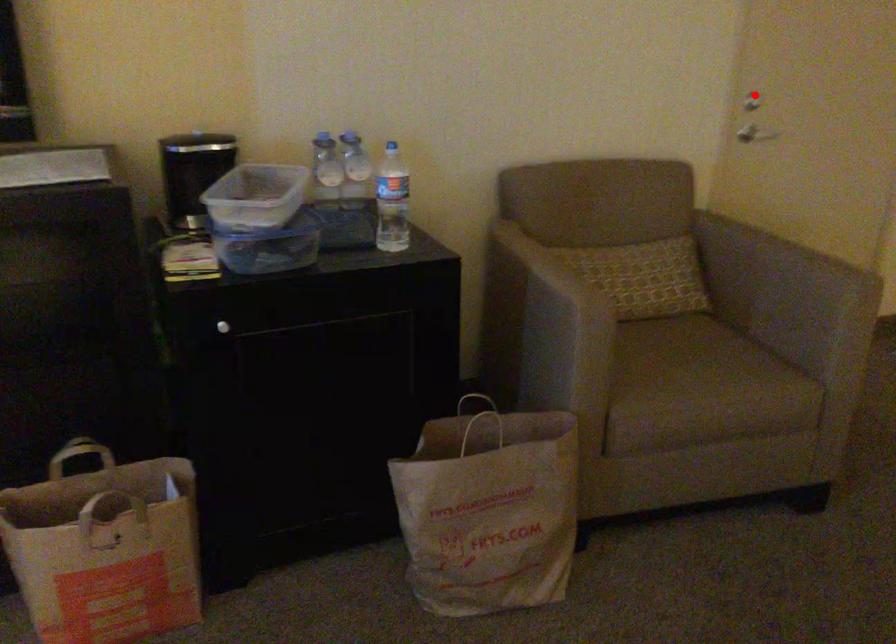
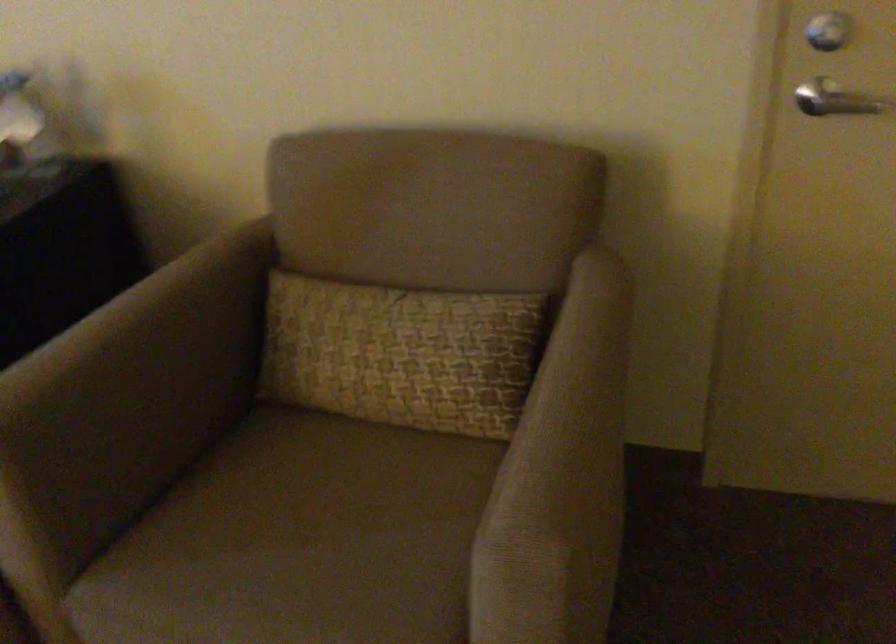
Locate, in the second image, the point that corresponds to the highlighted location in the first image.

(829, 31)